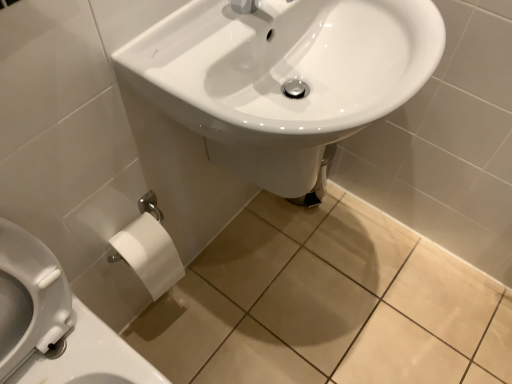
Question: Is white matte toilet paper at lower left facing away from white paper at lower left?

Choices:
 (A) yes
 (B) no

Answer: (B)

Question: Considering the relative positions of white matte toilet paper at lower left and white paper at lower left in the image provided, is white matte toilet paper at lower left to the left of white paper at lower left from the viewer's perspective?

Choices:
 (A) no
 (B) yes

Answer: (A)

Question: From a real-world perspective, does white matte toilet paper at lower left stand above white paper at lower left?

Choices:
 (A) yes
 (B) no

Answer: (B)

Question: Considering the relative sizes of white matte toilet paper at lower left and white paper at lower left in the image provided, is white matte toilet paper at lower left shorter than white paper at lower left?

Choices:
 (A) no
 (B) yes

Answer: (B)

Question: Does white matte toilet paper at lower left have a greater height compared to white paper at lower left?

Choices:
 (A) no
 (B) yes

Answer: (A)

Question: Does white matte toilet paper at lower left lie behind white paper at lower left?

Choices:
 (A) no
 (B) yes

Answer: (B)

Question: From the image's perspective, is white glossy sink at center over white matte toilet paper at lower left?

Choices:
 (A) no
 (B) yes

Answer: (B)

Question: Can you confirm if white glossy sink at center is smaller than white matte toilet paper at lower left?

Choices:
 (A) yes
 (B) no

Answer: (B)

Question: From the image's perspective, is white glossy sink at center located beneath white matte toilet paper at lower left?

Choices:
 (A) no
 (B) yes

Answer: (A)

Question: Is white glossy sink at center bigger than white matte toilet paper at lower left?

Choices:
 (A) yes
 (B) no

Answer: (A)

Question: Is white glossy sink at center beside white matte toilet paper at lower left?

Choices:
 (A) yes
 (B) no

Answer: (B)

Question: From a real-world perspective, is white glossy sink at center positioned under white matte toilet paper at lower left based on gravity?

Choices:
 (A) yes
 (B) no

Answer: (B)

Question: Does white paper at lower left have a smaller size compared to white glossy sink at center?

Choices:
 (A) no
 (B) yes

Answer: (B)